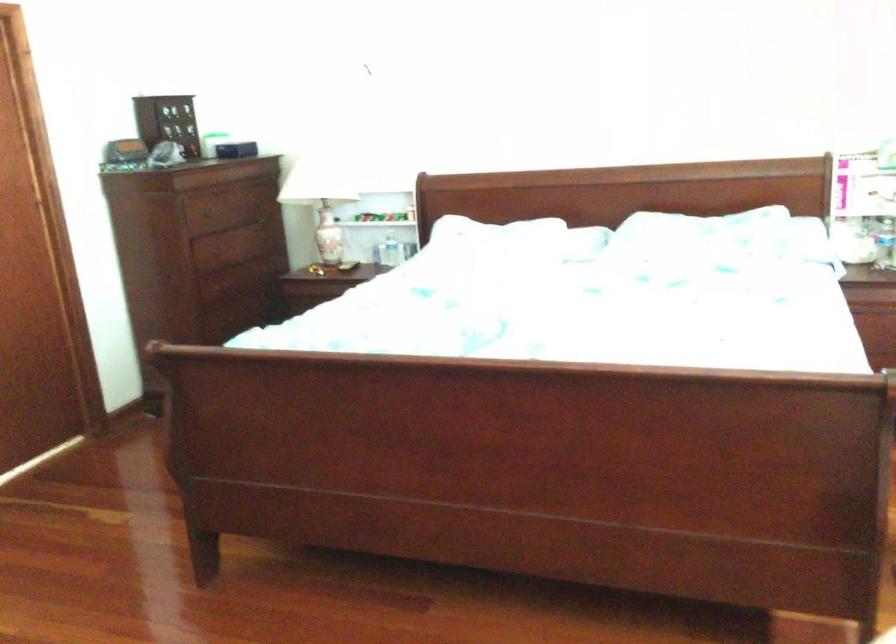
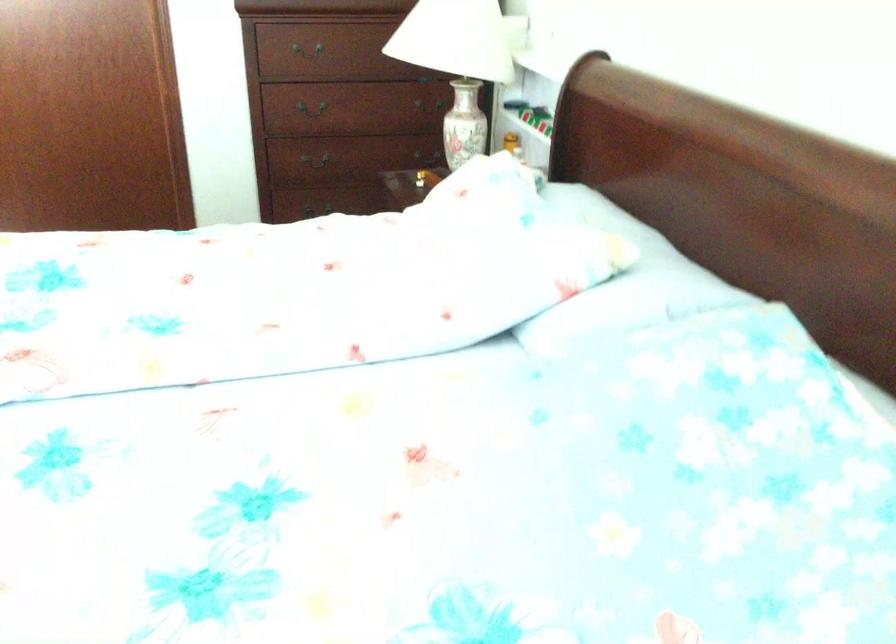
The point at (343, 243) is marked in the first image. Where is the corresponding point in the second image?

(463, 124)